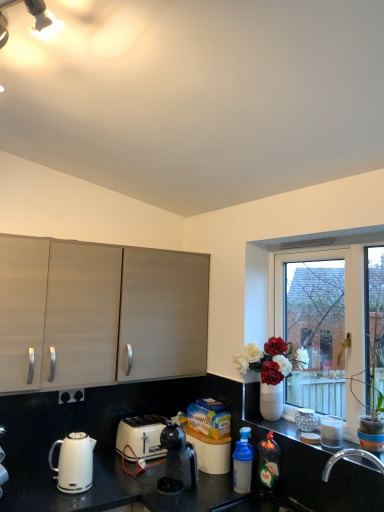
Question: Is the position of metallic silver canisters at right, marked as the 1th appliance in a back-to-front arrangement, less distant than that of white plastic toaster at lower center?

Choices:
 (A) no
 (B) yes

Answer: (B)

Question: Does metallic silver canisters at right, marked as the 2th appliance in a front-to-back arrangement, turn towards white plastic toaster at lower center?

Choices:
 (A) yes
 (B) no

Answer: (B)

Question: Can we say metallic silver canisters at right, marked as the 2th appliance in a front-to-back arrangement, lies outside white plastic toaster at lower center?

Choices:
 (A) yes
 (B) no

Answer: (A)

Question: Is white plastic toaster at lower center located within metallic silver canisters at right, marked as the 2th appliance in a front-to-back arrangement?

Choices:
 (A) no
 (B) yes

Answer: (A)

Question: From the image's perspective, is metallic silver canisters at right, marked as the 2th appliance in a front-to-back arrangement, below white plastic toaster at lower center?

Choices:
 (A) yes
 (B) no

Answer: (B)

Question: Considering the relative positions of metallic silver canisters at right, marked as the 1th appliance in a back-to-front arrangement, and white plastic toaster at lower center in the image provided, is metallic silver canisters at right, marked as the 1th appliance in a back-to-front arrangement, to the right of white plastic toaster at lower center from the viewer's perspective?

Choices:
 (A) no
 (B) yes

Answer: (B)

Question: Does white glossy jar at lower right, which is the second appliance in back-to-front order, contain metallic silver canisters at right, marked as the 1th appliance in a back-to-front arrangement?

Choices:
 (A) no
 (B) yes

Answer: (A)

Question: From the image's perspective, is white glossy jar at lower right, which is the second appliance in back-to-front order, on top of metallic silver canisters at right, marked as the 1th appliance in a back-to-front arrangement?

Choices:
 (A) no
 (B) yes

Answer: (B)

Question: From a real-world perspective, is white glossy jar at lower right, positioned as the first appliance in front-to-back order, beneath metallic silver canisters at right, marked as the 2th appliance in a front-to-back arrangement?

Choices:
 (A) no
 (B) yes

Answer: (A)

Question: Is white glossy jar at lower right, positioned as the first appliance in front-to-back order, bigger than metallic silver canisters at right, marked as the 2th appliance in a front-to-back arrangement?

Choices:
 (A) yes
 (B) no

Answer: (B)

Question: Is white glossy jar at lower right, positioned as the first appliance in front-to-back order, at the left side of metallic silver canisters at right, marked as the 1th appliance in a back-to-front arrangement?

Choices:
 (A) yes
 (B) no

Answer: (B)

Question: Does white glossy jar at lower right, positioned as the first appliance in front-to-back order, lie behind metallic silver canisters at right, marked as the 2th appliance in a front-to-back arrangement?

Choices:
 (A) no
 (B) yes

Answer: (A)

Question: Is translucent plastic bottle at lower right, placed as the 1th bottle when sorted from right to left, located outside white glossy kettle at lower left?

Choices:
 (A) yes
 (B) no

Answer: (A)